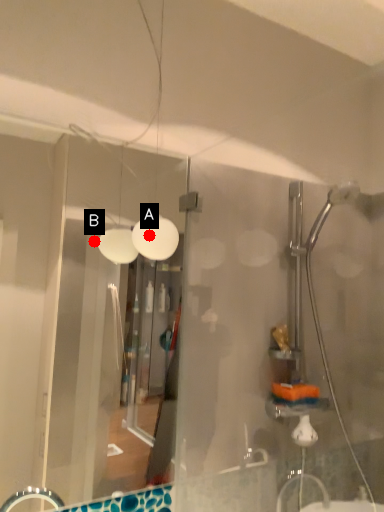
Question: Two points are circled on the image, labeled by A and B beside each circle. Which point is farther from the camera taking this photo?

Choices:
 (A) A is further
 (B) B is further

Answer: (B)